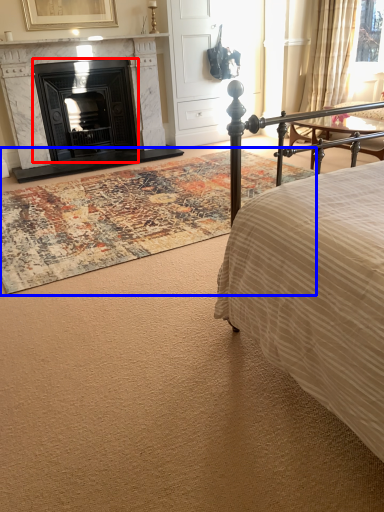
Question: Which of the following is the closest to the observer, fireplace (highlighted by a red box) or mat (highlighted by a blue box)?

Choices:
 (A) fireplace
 (B) mat

Answer: (B)